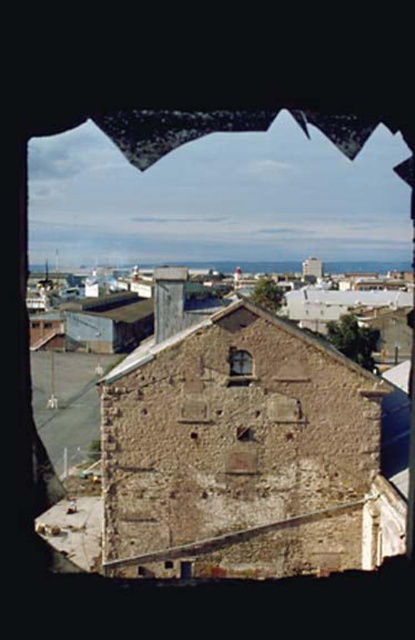
You are standing in front of an old stone building with a distinctive window frame. You notice two features at the center of the frame. One is the matte glass window at center, and the other is the rusty metal hole at center. From your perspective, which of these two features is positioned to the left?

The matte glass window at center is to the left of the rusty metal hole at center.

You are a contractor assessing the structural integrity of the building. You notice the matte glass window at center and the rusty metal hole at center. How far apart are these two features from each other?

The matte glass window at center and the rusty metal hole at center are 13.62 feet apart from each other.